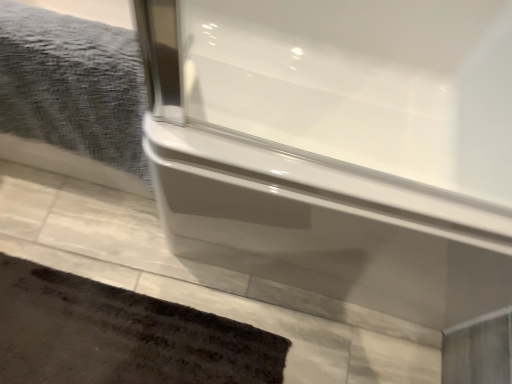
Identify the location of vacant space underneath dark brown textured bath mat at lower left (from a real-world perspective). (123, 341).